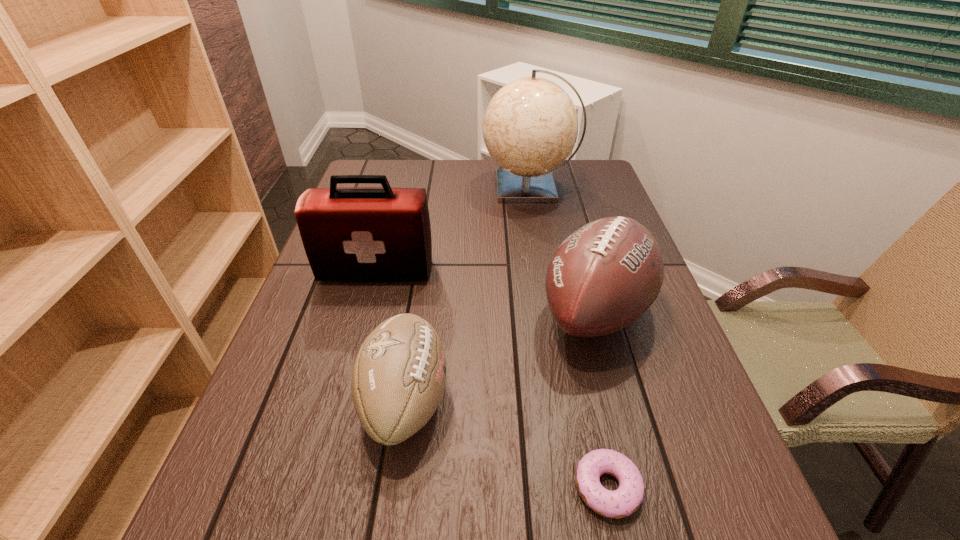
Locate an element on the screen. object located at the far right corner is located at coordinates (530, 127).

At what (x,y) coordinates should I click in order to perform the action: click on free space at the left edge of the desktop. Please return your answer as a coordinate pair (x, y). The height and width of the screenshot is (540, 960). Looking at the image, I should click on (277, 374).

In the image, there is a desktop. Identify the location of vacant region at the right edge. The height and width of the screenshot is (540, 960). (707, 476).

Identify the location of vacant space at the far left corner of the desktop. Image resolution: width=960 pixels, height=540 pixels. (394, 166).

In order to click on empty space that is in between the right football (American) and the second shortest object in this screenshot , I will do `click(501, 356)`.

Find the location of a particular element. The width and height of the screenshot is (960, 540). free space between the tallest object and the shortest object is located at coordinates (568, 337).

Find the location of a particular element. This screenshot has width=960, height=540. vacant space that is in between the taller football (American) and the shortest object is located at coordinates (602, 399).

I want to click on vacant space that's between the right football (American) and the second shortest object, so click(x=501, y=356).

The height and width of the screenshot is (540, 960). What are the coordinates of `free spot between the first aid kit and the tallest object` in the screenshot? It's located at (453, 230).

Locate an element on the screen. This screenshot has height=540, width=960. free spot between the left football (American) and the shortest object is located at coordinates (507, 443).